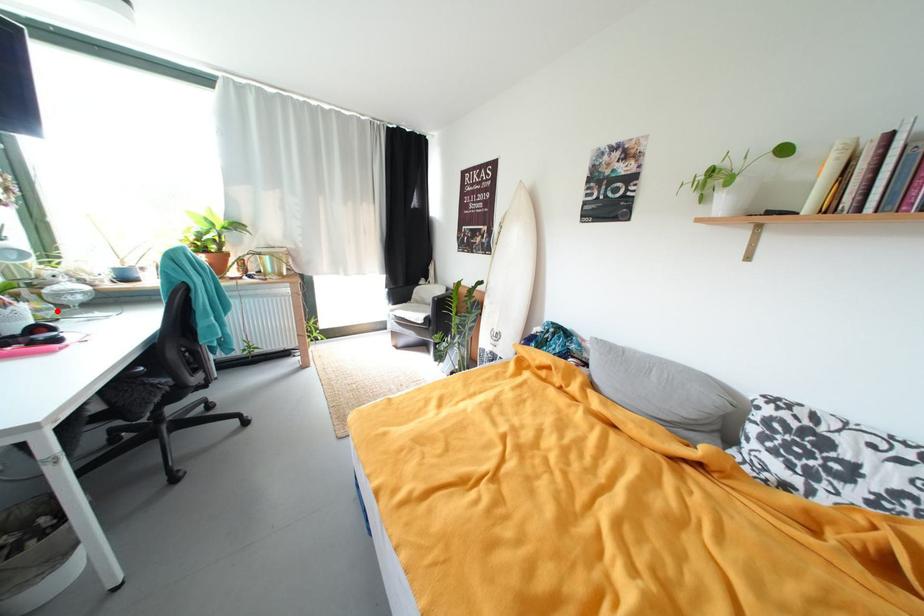
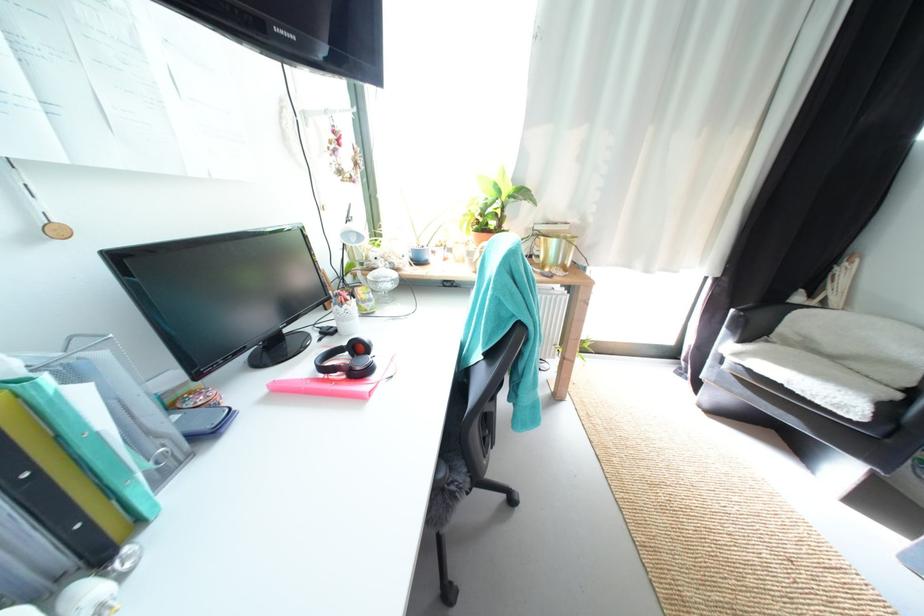
Locate, in the second image, the point that corresponds to the highlighted location in the first image.

(378, 302)